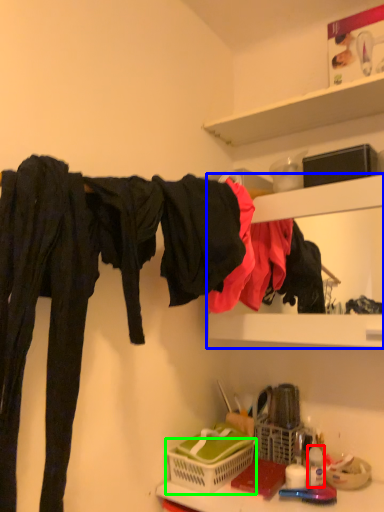
Question: Which object is the closest to the toiletry (highlighted by a red box)? Choose among these: cabinet (highlighted by a blue box) or basket (highlighted by a green box).

Choices:
 (A) cabinet
 (B) basket

Answer: (B)